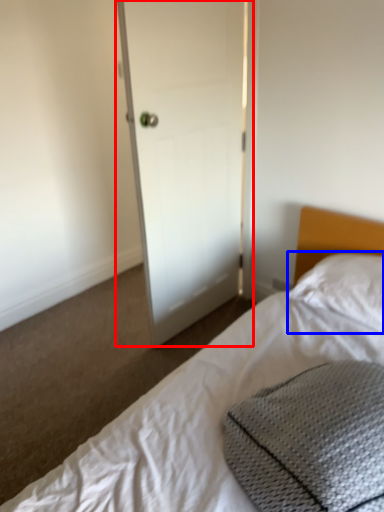
Question: Which of the following is the farthest to the observer, door (highlighted by a red box) or pillow (highlighted by a blue box)?

Choices:
 (A) door
 (B) pillow

Answer: (A)